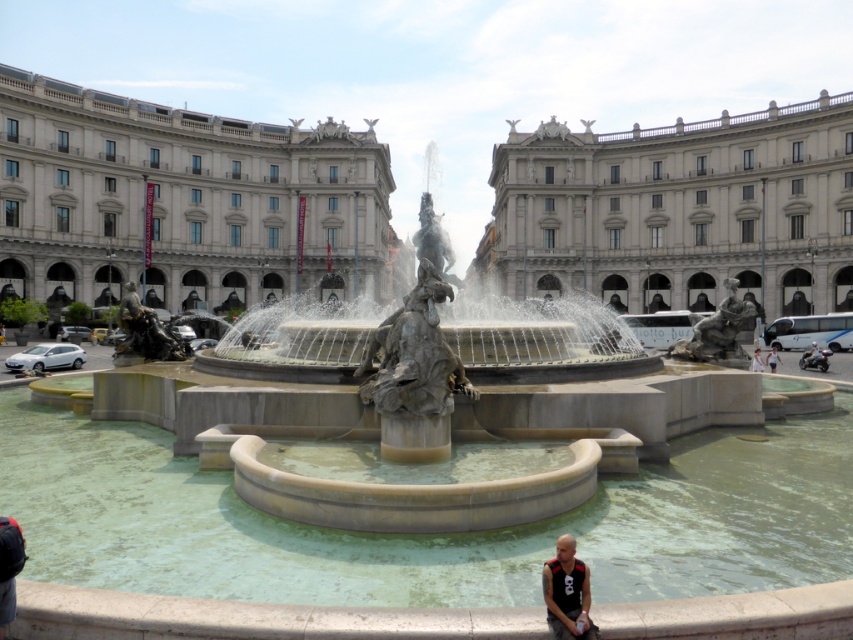
Question: Does white marble palace at center come behind white fabric person at center?

Choices:
 (A) no
 (B) yes

Answer: (B)

Question: Which object appears closest to the camera in this image?

Choices:
 (A) white cotton shirt at lower right
 (B) beige stone palace at center
 (C) white fabric person at center

Answer: (C)

Question: Does beige stone palace at center appear on the right side of white cotton shirt at lower right?

Choices:
 (A) no
 (B) yes

Answer: (A)

Question: Among these objects, which one is farthest from the camera?

Choices:
 (A) white cotton shirt at lower right
 (B) white fabric person at center
 (C) white marble palace at center
 (D) matte black tank top at lower right

Answer: (C)

Question: Does beige stone palace at center have a larger size compared to white cotton shirt at lower right?

Choices:
 (A) no
 (B) yes

Answer: (B)

Question: Which of the following is the farthest from the observer?

Choices:
 (A) white marble palace at center
 (B) beige stone palace at center

Answer: (A)